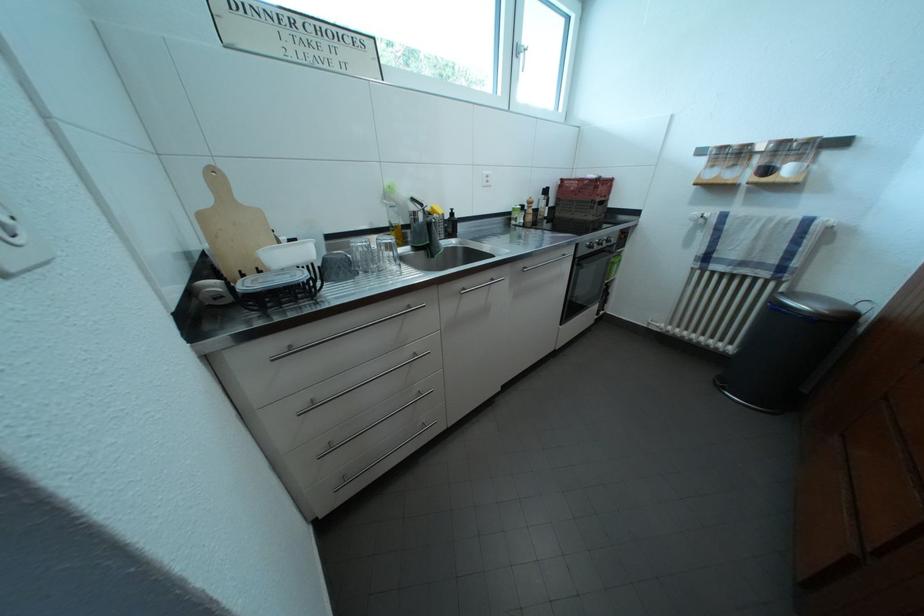
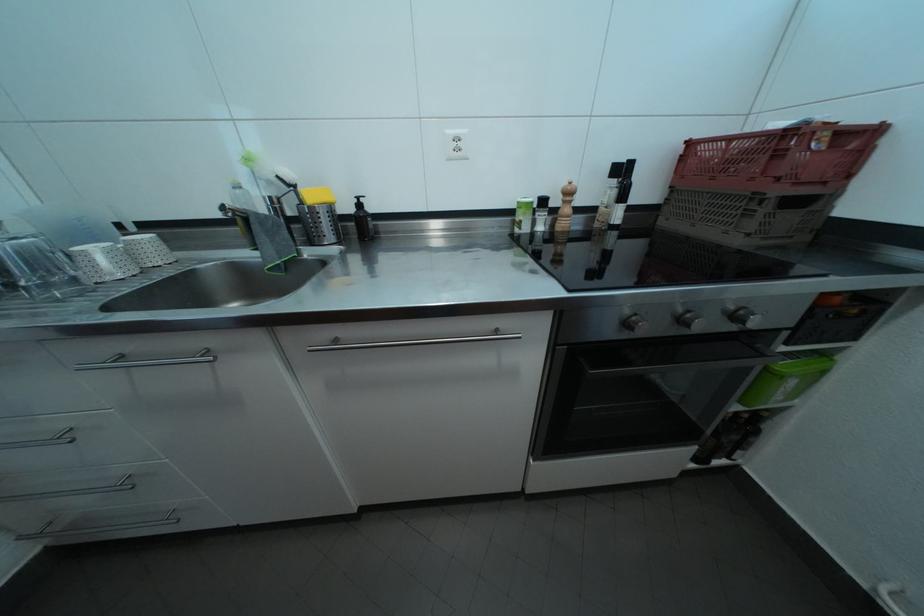
The point at (605, 193) is marked in the first image. Where is the corresponding point in the second image?

(787, 161)